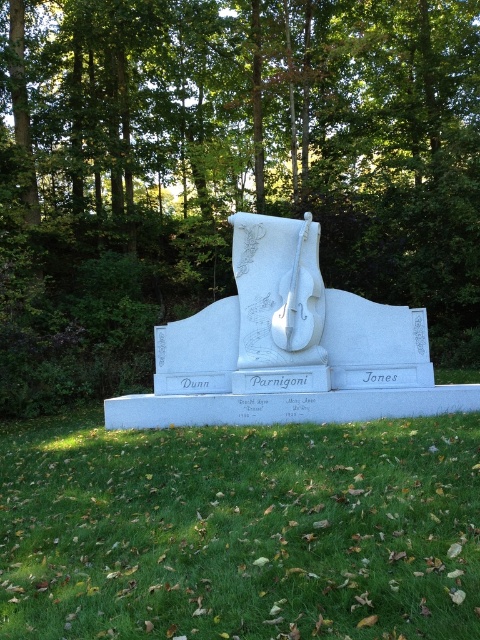
Can you confirm if green leafy tree at center is thinner than green grass at lower center?

No, green leafy tree at center is not thinner than green grass at lower center.

Who is positioned more to the left, green leafy tree at center or green grass at lower center?

Positioned to the left is green leafy tree at center.

Between point (130, 298) and point (325, 448), which one is positioned in front?

Point (325, 448) is in front.

Find the location of a particular element. The width and height of the screenshot is (480, 640). green leafy tree at center is located at coordinates (226, 168).